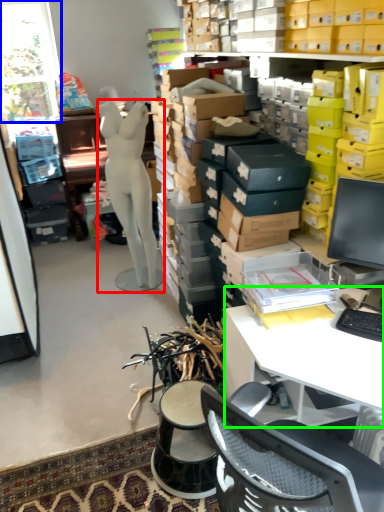
Question: Which object is positioned farthest from person (highlighted by a red box)? Select from window (highlighted by a blue box) and desk (highlighted by a green box).

Choices:
 (A) window
 (B) desk

Answer: (B)